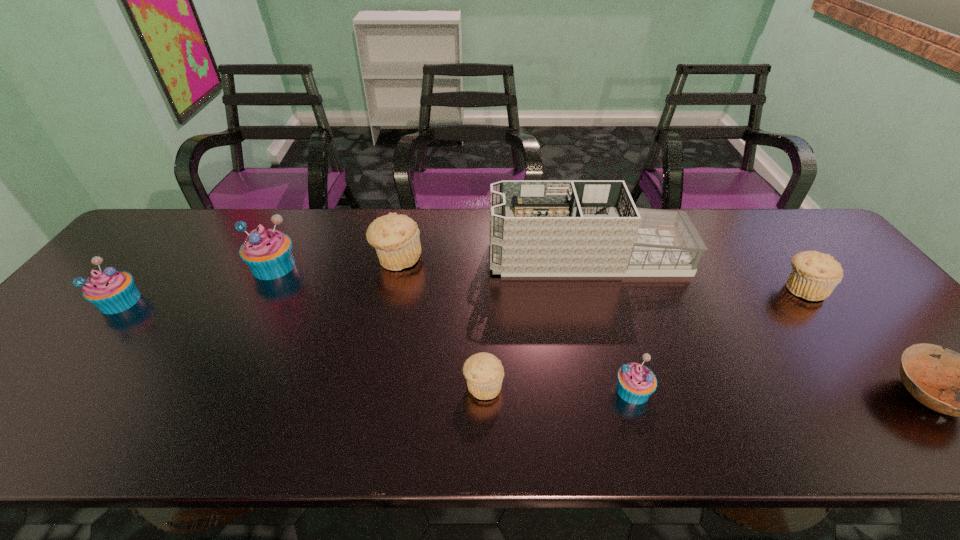
You are a GUI agent. You are given a task and a screenshot of the screen. Output one action in this format:
    pyautogui.click(x=<x>, y=<y>)
    Task: Click on the dollhouse
    
    Given the screenshot: What is the action you would take?
    pyautogui.click(x=538, y=228)

Find the location of a particular element. the second blue muffin from left to right is located at coordinates (268, 253).

In order to click on the seventh object from right to left in this screenshot , I will do `click(268, 253)`.

The height and width of the screenshot is (540, 960). Find the location of `the biggest beige muffin`. the biggest beige muffin is located at coordinates (396, 238).

The height and width of the screenshot is (540, 960). I want to click on the fourth muffin from right to left, so click(x=396, y=238).

The image size is (960, 540). In order to click on the second nearest blue muffin in this screenshot , I will do `click(111, 291)`.

Find the location of a particular element. The width and height of the screenshot is (960, 540). the second smallest blue muffin is located at coordinates (111, 291).

You are a GUI agent. You are given a task and a screenshot of the screen. Output one action in this format:
    pyautogui.click(x=<x>, y=<y>)
    Task: Click on the rightmost muffin
    
    Given the screenshot: What is the action you would take?
    pyautogui.click(x=814, y=275)

Identify the location of the rightmost beige muffin. (814, 275).

The width and height of the screenshot is (960, 540). I want to click on the second muffin from right to left, so click(635, 384).